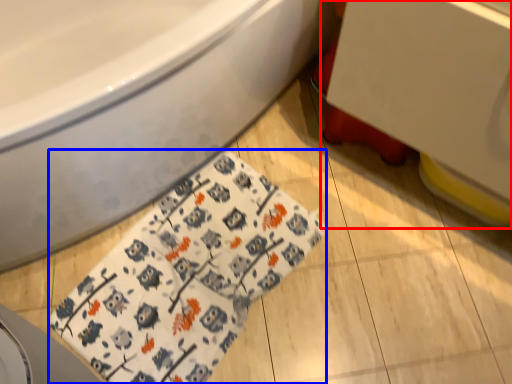
Question: Among these objects, which one is farthest to the camera, sink (highlighted by a red box) or blanket (highlighted by a blue box)?

Choices:
 (A) sink
 (B) blanket

Answer: (B)